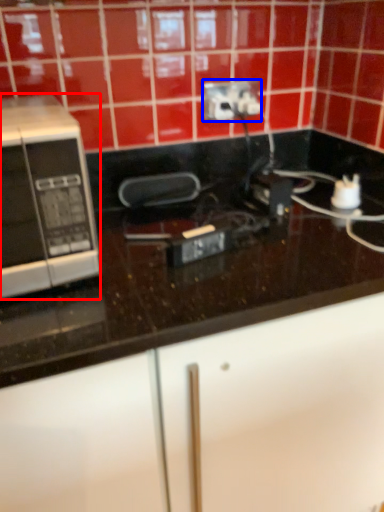
Question: Which object is closer to the camera taking this photo, microwave oven (highlighted by a red box) or power plugs and sockets (highlighted by a blue box)?

Choices:
 (A) microwave oven
 (B) power plugs and sockets

Answer: (A)